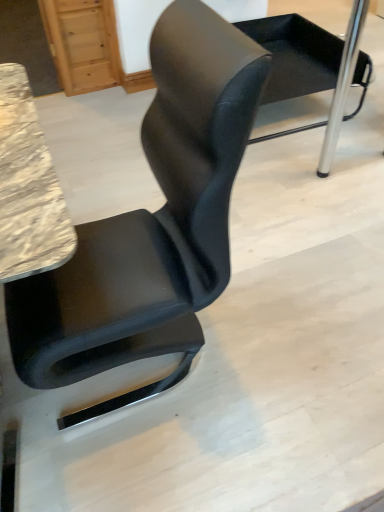
At what (x,y) coordinates should I click in order to perform the action: click on black matte chair at center. Please return your answer as a coordinate pair (x, y). The image size is (384, 512). Looking at the image, I should click on (312, 67).

What do you see at coordinates (312, 67) in the screenshot? I see `black matte chair at center` at bounding box center [312, 67].

At what (x,y) coordinates should I click in order to perform the action: click on black matte chair at center. Please return your answer as a coordinate pair (x, y). The height and width of the screenshot is (512, 384). Looking at the image, I should click on (312, 67).